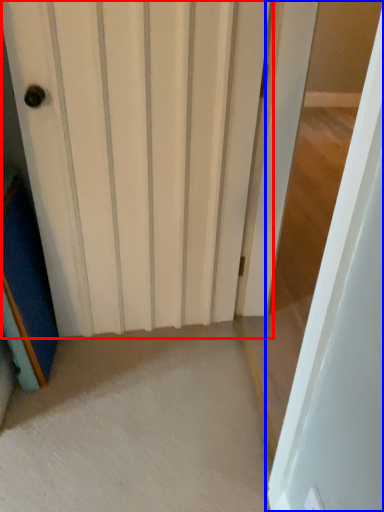
Question: Among these objects, which one is farthest to the camera, door (highlighted by a red box) or door (highlighted by a blue box)?

Choices:
 (A) door
 (B) door

Answer: (A)